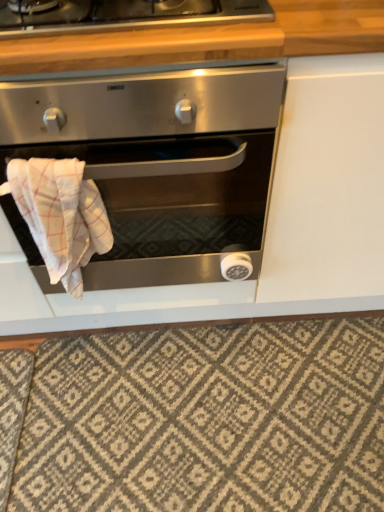
Identify the location of vacant space situated above patterned carpet at lower center (from a real-world perspective). The width and height of the screenshot is (384, 512). (211, 404).